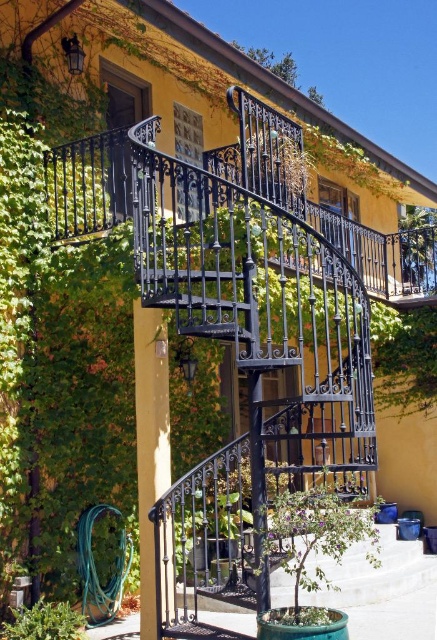
Can you confirm if green leafy plant at center is taller than green leafy plant at lower left?

Correct, green leafy plant at center is much taller as green leafy plant at lower left.

Is green leafy plant at center below green leafy plant at lower left?

Actually, green leafy plant at center is above green leafy plant at lower left.

This screenshot has height=640, width=437. What are the coordinates of `green leafy plant at center` in the screenshot? It's located at (314, 545).